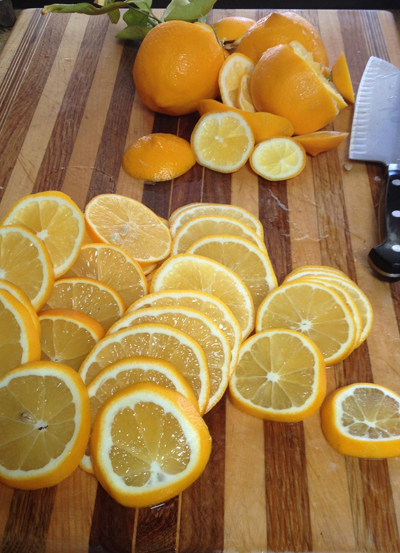
Image resolution: width=400 pixels, height=553 pixels. I want to click on dark brown part of cutting board, so click(199, 519), click(167, 526), click(111, 528), click(33, 529), click(284, 519), click(374, 518).